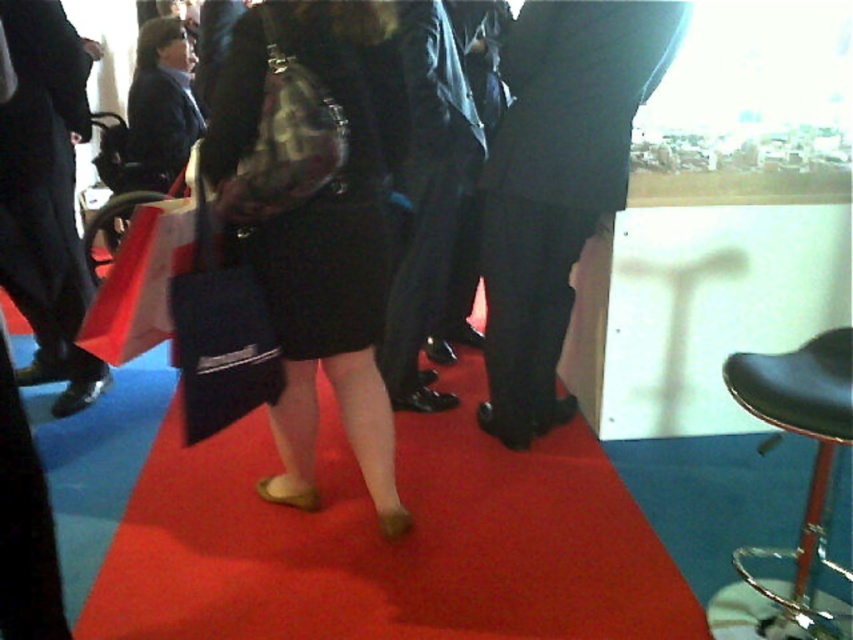
You are a photographer at a red carpet event. You need to position a 2m wide equipment stand on the red carpet at center without blocking the black leather pants at center. Is there enough space?

The red carpet at center is wider than the black leather pants at center, so there is sufficient space to place the 2m wide equipment stand on the red carpet at center without obstructing the black leather pants at center.

You are standing on the red carpet at a formal event and see the point at coordinates (x=320, y=230). What is located at that point?

The point at coordinates (x=320, y=230) corresponds to the matte black skirt at center.